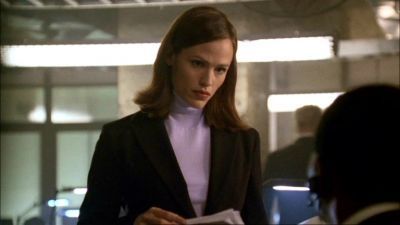
Image resolution: width=400 pixels, height=225 pixels. Identify the location of desk lamp. (289, 186), (81, 189), (50, 202).